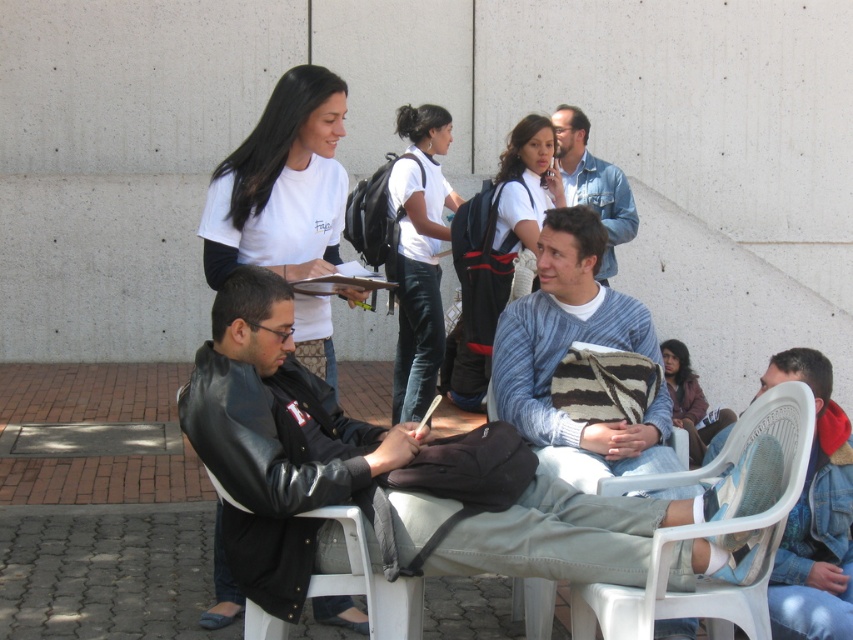
Question: Among these objects, which one is farthest from the camera?

Choices:
 (A) white plastic chair at lower left
 (B) knitted blue sweater at center
 (C) white matte t-shirt at upper center
 (D) white matte shirt at center

Answer: (D)

Question: Estimate the real-world distances between objects in this image. Which object is closer to the white cotton shirt at center?

Choices:
 (A) knitted blue sweater at center
 (B) denim jacket at lower right
 (C) white plastic chair at lower left

Answer: (A)

Question: Which of the following is the closest to the observer?

Choices:
 (A) (703, 438)
 (B) (386, 588)
 (C) (676, 608)

Answer: (C)

Question: Can you confirm if white matte t-shirt at upper center is positioned below white plastic chair at lower left?

Choices:
 (A) no
 (B) yes

Answer: (A)

Question: Can you confirm if white matte shirt at center is positioned to the right of white plastic chair at lower left?

Choices:
 (A) yes
 (B) no

Answer: (A)

Question: Is white cotton shirt at center below denim jacket at upper center?

Choices:
 (A) yes
 (B) no

Answer: (A)